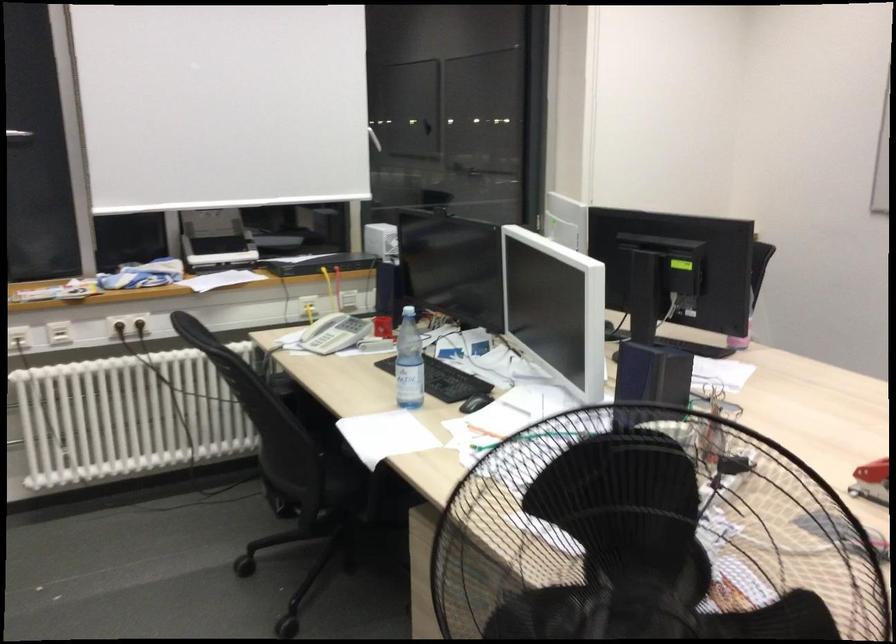
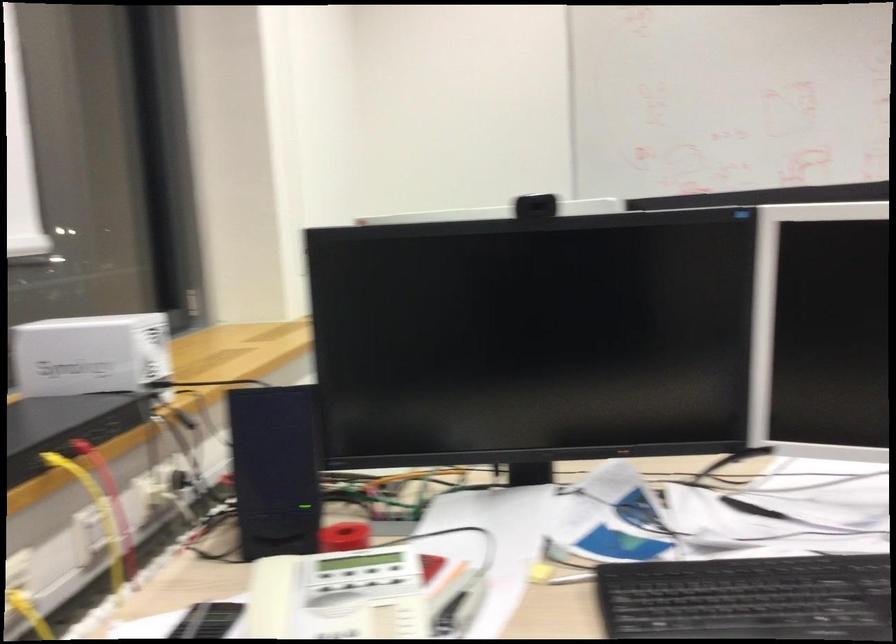
Where in the second image is the point corresponding to (x=345, y=322) from the first image?

(373, 590)